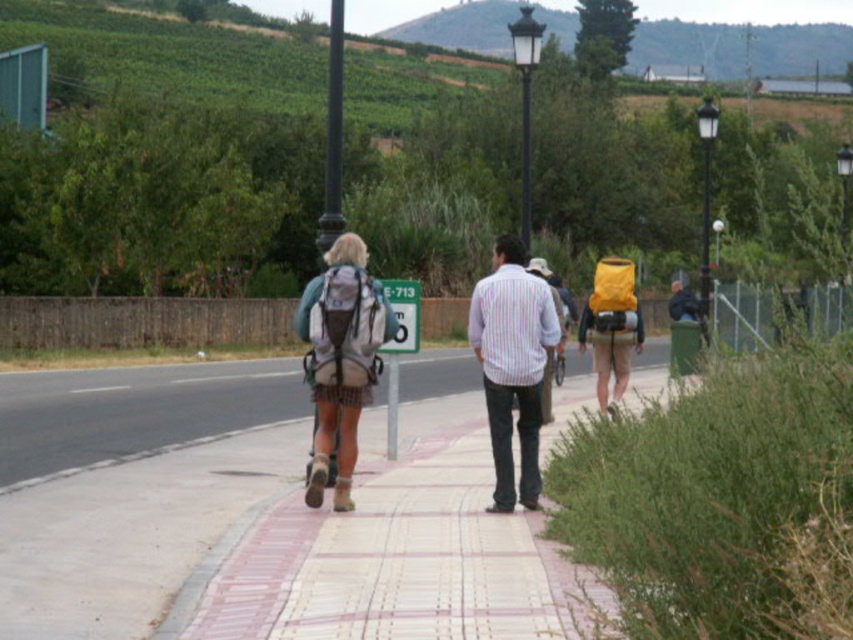
Between striped cotton shirt at center and matte gray backpack at center, which one appears on the right side from the viewer's perspective?

striped cotton shirt at center is more to the right.

Measure the distance between striped cotton shirt at center and matte gray backpack at center.

striped cotton shirt at center and matte gray backpack at center are 5.10 feet apart.

Describe the element at coordinates (512, 364) in the screenshot. I see `striped cotton shirt at center` at that location.

I want to click on striped cotton shirt at center, so click(x=512, y=364).

The image size is (853, 640). Describe the element at coordinates (392, 561) in the screenshot. I see `paved sidewalk at center` at that location.

Does paved sidewalk at center lie behind matte gray backpack at center?

No, it is in front of matte gray backpack at center.

Is point (556, 561) positioned behind point (337, 305)?

That is False.

You are a GUI agent. You are given a task and a screenshot of the screen. Output one action in this format:
    pyautogui.click(x=<x>, y=<y>)
    Task: Click on the paved sidewalk at center
    
    Given the screenshot: What is the action you would take?
    pyautogui.click(x=392, y=561)

Can you confirm if striped cotton shirt at center is positioned below green plastic sign at center?

Indeed, striped cotton shirt at center is positioned under green plastic sign at center.

Does striped cotton shirt at center have a larger size compared to green plastic sign at center?

Yes.

Describe the element at coordinates (512, 364) in the screenshot. This screenshot has height=640, width=853. I see `striped cotton shirt at center` at that location.

Locate an element on the screen. The image size is (853, 640). striped cotton shirt at center is located at coordinates (512, 364).